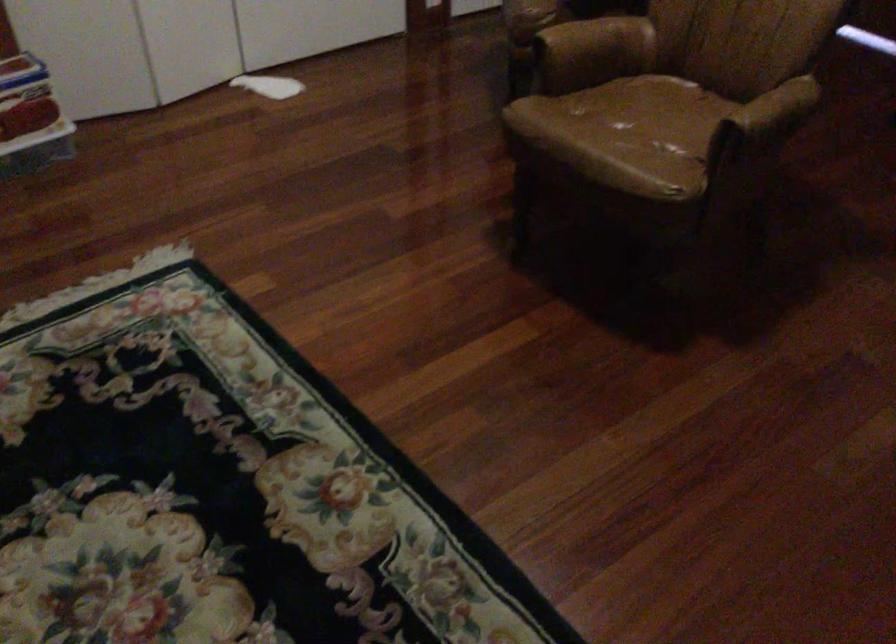
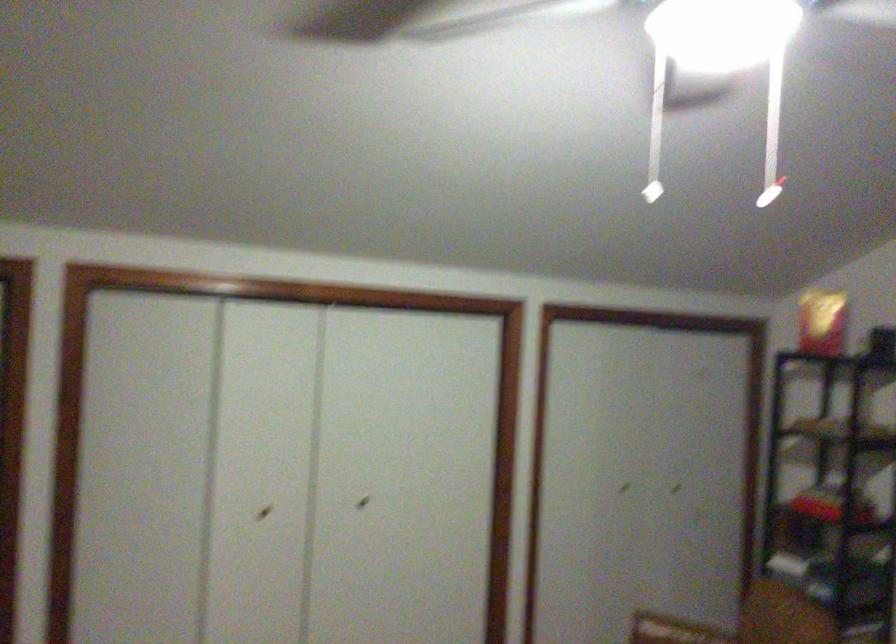
Question: The images are taken continuously from a first-person perspective. In which direction is your viewpoint rotating?

Choices:
 (A) Left
 (B) Right
 (C) Up
 (D) Down

Answer: (C)